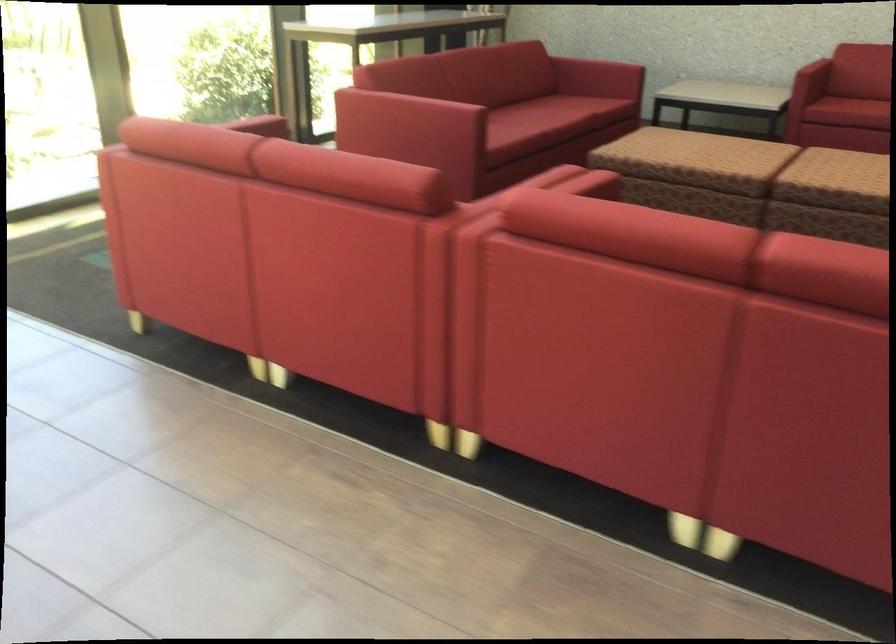
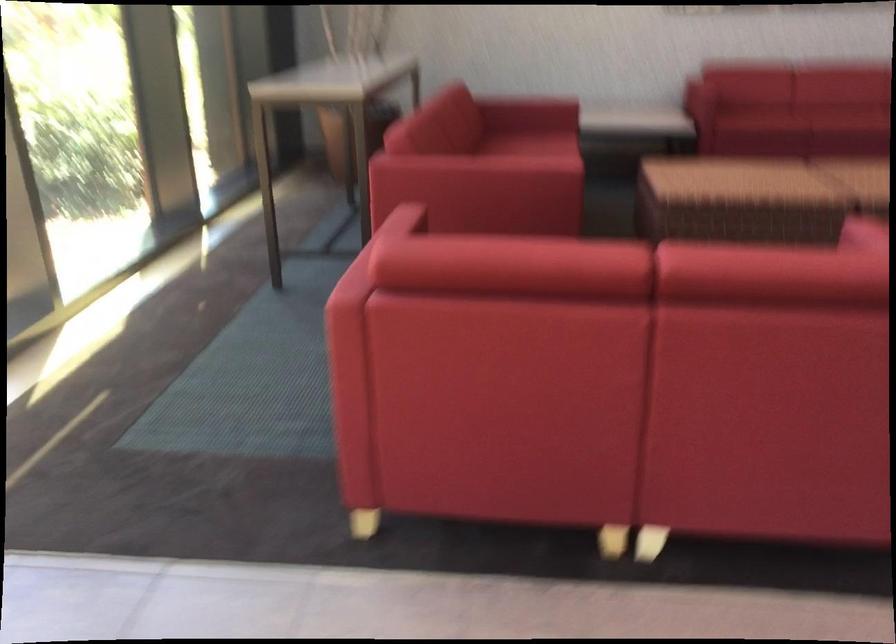
First-person continuous shooting, in which direction is the camera rotating?

The camera rotated toward right-down.